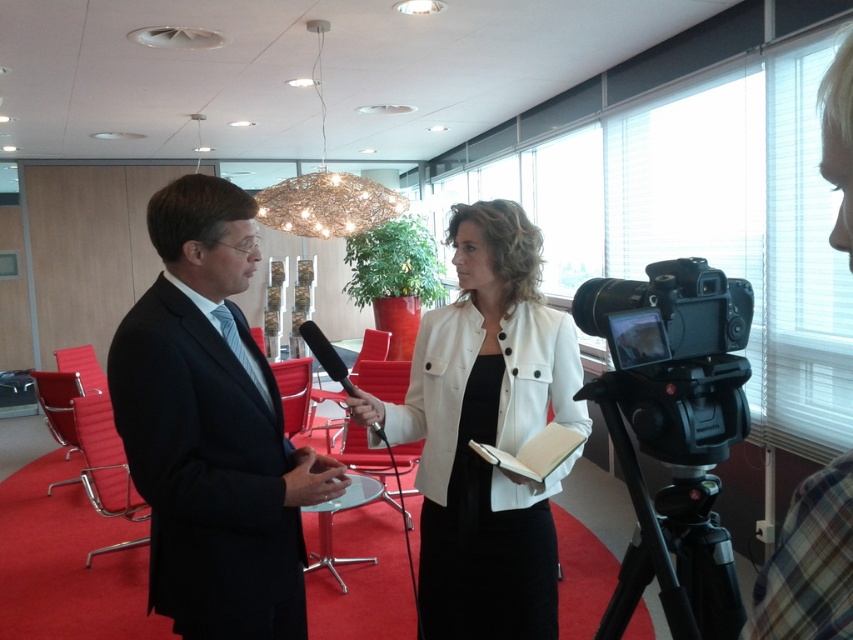
You are a videographer setting up for a live event. You need to film the white matte jacket at center without the black plastic video camera at right appearing in the shot. Is this possible based on their positions?

The black plastic video camera at right is behind the white matte jacket at center, so yes, the videographer can film the white matte jacket at center without the black plastic video camera at right appearing in the shot since it is positioned behind.

You are setting up a display in the conference room. You have a white matte jacket at center and a black plastic video camera at right. If you want to place both items on a shelf that can only hold items up to the width of the wider object, which object should determine the maximum width allowed on the shelf?

The white matte jacket at center might be wider than the black plastic video camera at right, so the maximum width should be determined by the white matte jacket at center to ensure both items fit.